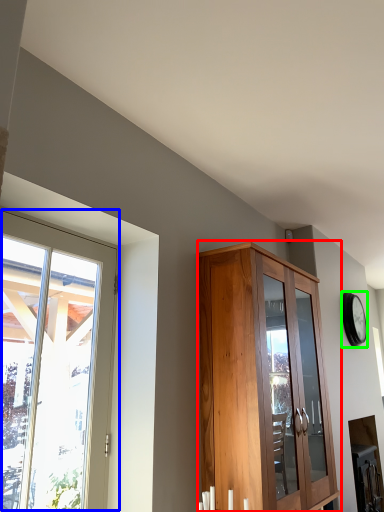
Question: Which object is the farthest from cupboard (highlighted by a red box)? Choose among these: window (highlighted by a blue box) or clock (highlighted by a green box).

Choices:
 (A) window
 (B) clock

Answer: (B)